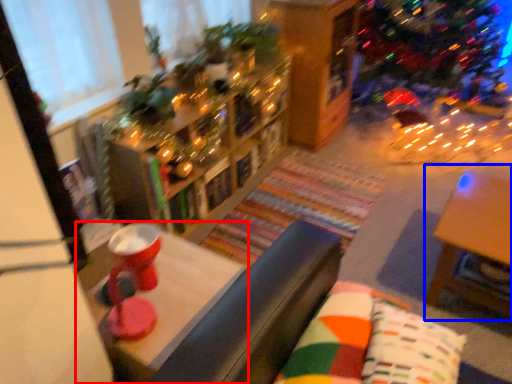
Question: Which object appears farthest to the camera in this image, table (highlighted by a red box) or table (highlighted by a blue box)?

Choices:
 (A) table
 (B) table

Answer: (B)